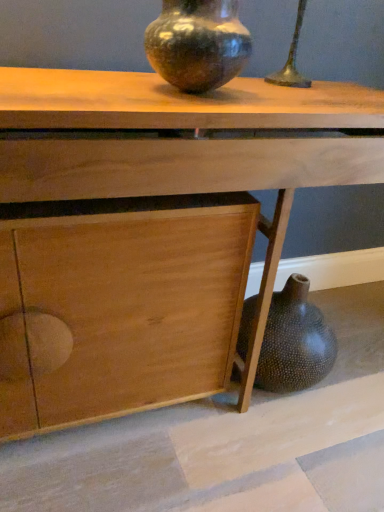
Locate an element on the screen. free point below speckled dark brown vase at upper center (from a real-world perspective) is located at coordinates (185, 94).